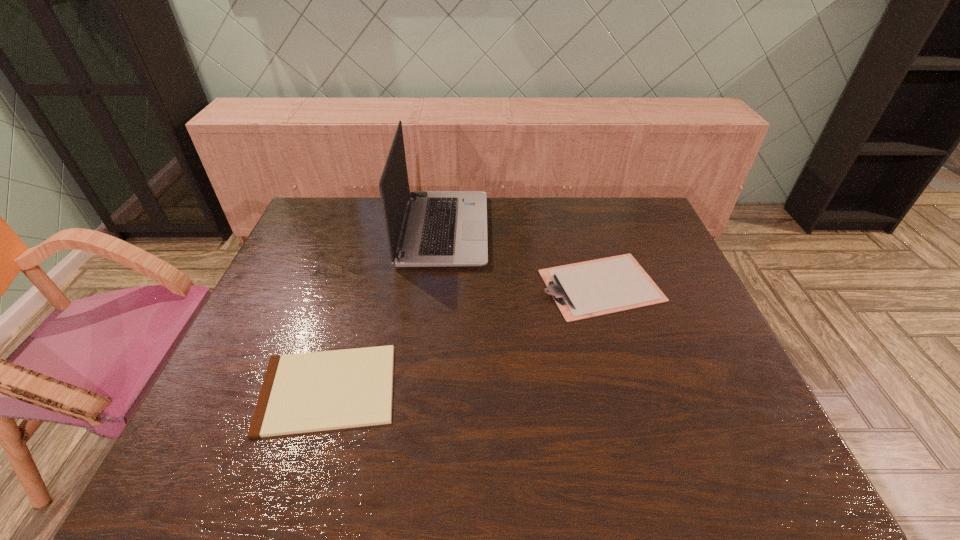
The width and height of the screenshot is (960, 540). Find the location of `the tallest object`. the tallest object is located at coordinates (441, 228).

Locate an element on the screen. This screenshot has height=540, width=960. the taller clipboard is located at coordinates 582,290.

Where is `the second tallest object`? the second tallest object is located at coordinates (582, 290).

Locate an element on the screen. the nearer clipboard is located at coordinates (308, 392).

Find the location of a particular element. This screenshot has width=960, height=540. the shortest object is located at coordinates (308, 392).

In order to click on vacant area situated on the screen of the laptop computer in this screenshot , I will do `click(556, 230)`.

Find the location of a particular element. This screenshot has width=960, height=540. vacant space located on the back of the second shortest object is located at coordinates (588, 241).

Image resolution: width=960 pixels, height=540 pixels. Identify the location of vacant space situated 0.070m on the right of the shortest object. (427, 389).

What are the coordinates of `object that is positioned at the far edge` in the screenshot? It's located at (441, 228).

Where is `object that is at the near edge`? object that is at the near edge is located at coordinates (308, 392).